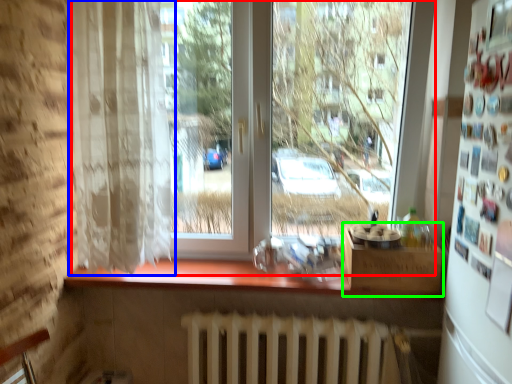
Question: Estimate the real-world distances between objects in this image. Which object is closer to window (highlighted by a red box), curtain (highlighted by a blue box) or window box (highlighted by a green box)?

Choices:
 (A) curtain
 (B) window box

Answer: (A)